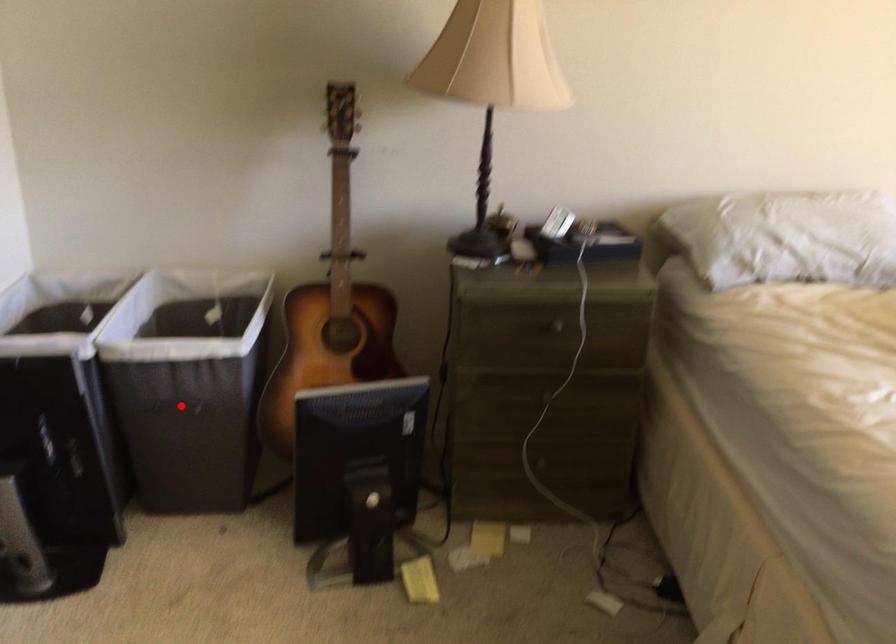
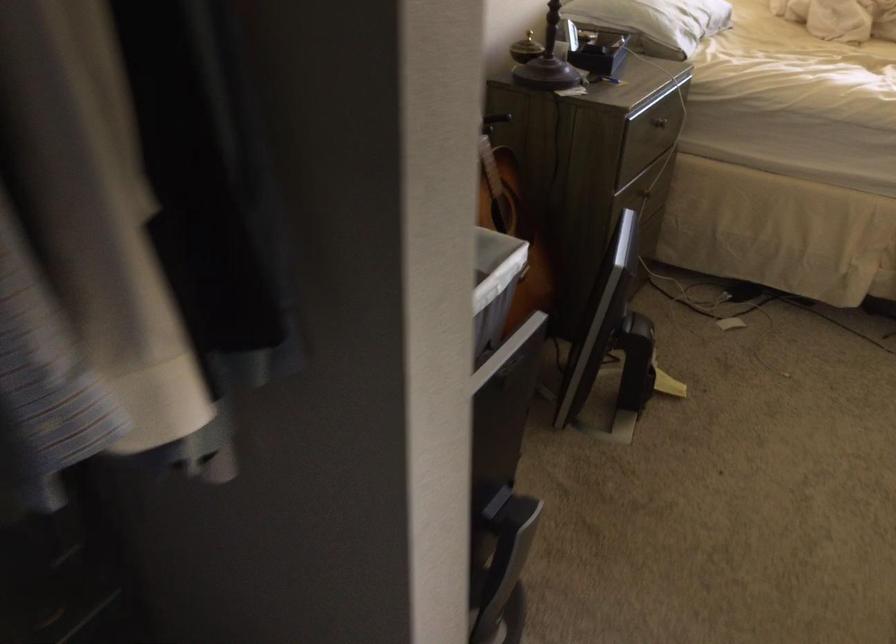
Question: I am providing you with two images of the same scene from different viewpoints. A red point is marked on the first image. At the location where the point appears in image 1, is it still visible in image 2?

Choices:
 (A) Yes
 (B) No

Answer: (B)